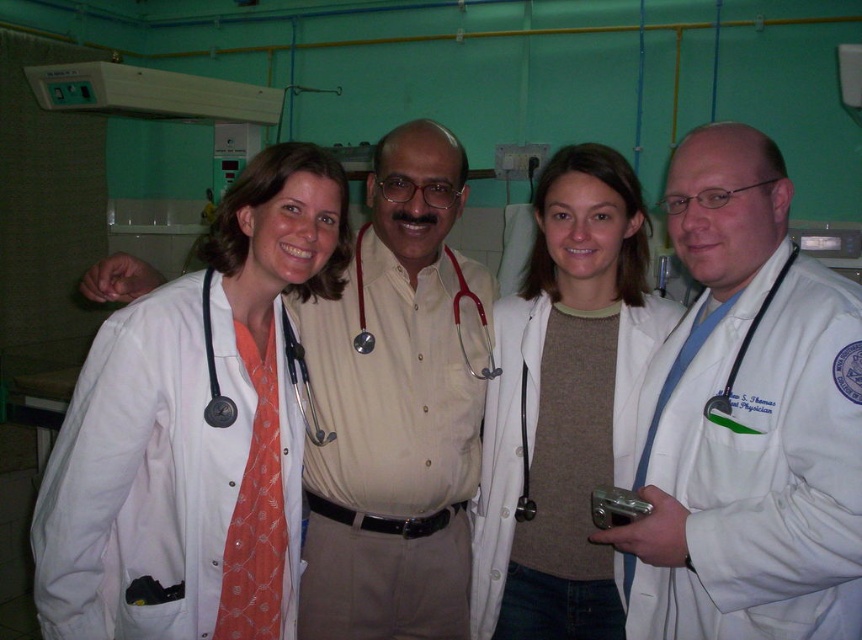
Does beige stethoscope at center have a larger size compared to black rubber stethoscope at right?

Indeed, beige stethoscope at center has a larger size compared to black rubber stethoscope at right.

Describe the element at coordinates (397, 406) in the screenshot. This screenshot has height=640, width=862. I see `beige stethoscope at center` at that location.

Between point (469, 458) and point (723, 410), which one is positioned behind?

The point (469, 458) is more distant.

Image resolution: width=862 pixels, height=640 pixels. I want to click on beige stethoscope at center, so [x=397, y=406].

Is white matte lab coat at left behind beige stethoscope at center?

No, white matte lab coat at left is in front of beige stethoscope at center.

Is point (280, 476) behind point (309, 609)?

No, (280, 476) is closer to viewer.

What do you see at coordinates (194, 432) in the screenshot? Image resolution: width=862 pixels, height=640 pixels. I see `white matte lab coat at left` at bounding box center [194, 432].

What are the coordinates of `white matte lab coat at left` in the screenshot? It's located at (194, 432).

Does white matte lab coat at center have a smaller size compared to matte white coat at center?

No, white matte lab coat at center is not smaller than matte white coat at center.

This screenshot has width=862, height=640. What do you see at coordinates (746, 419) in the screenshot?
I see `white matte lab coat at center` at bounding box center [746, 419].

Identify the location of white matte lab coat at center. Image resolution: width=862 pixels, height=640 pixels. (746, 419).

At what (x,y) coordinates should I click in order to perform the action: click on white matte lab coat at center. Please return your answer as a coordinate pair (x, y). This screenshot has height=640, width=862. Looking at the image, I should click on pos(746,419).